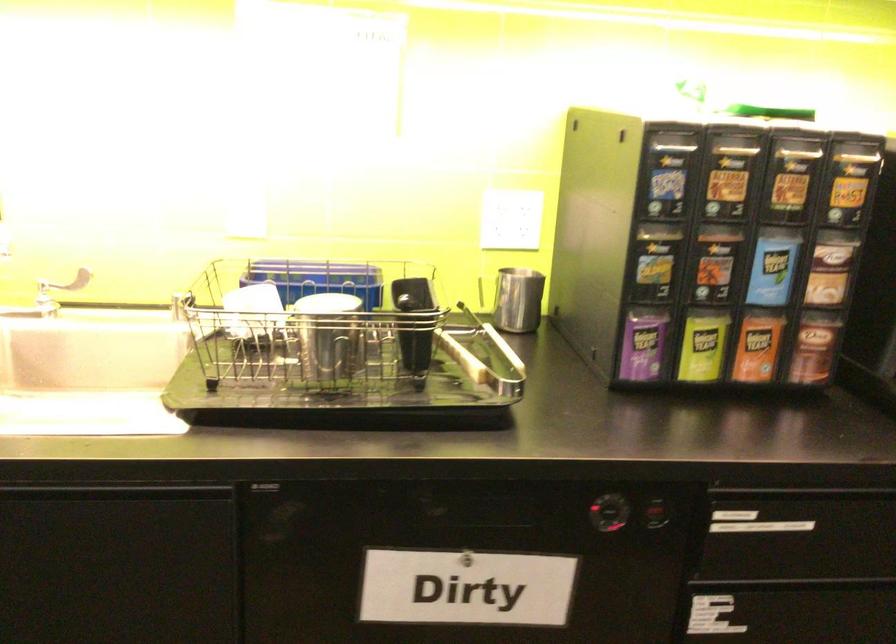
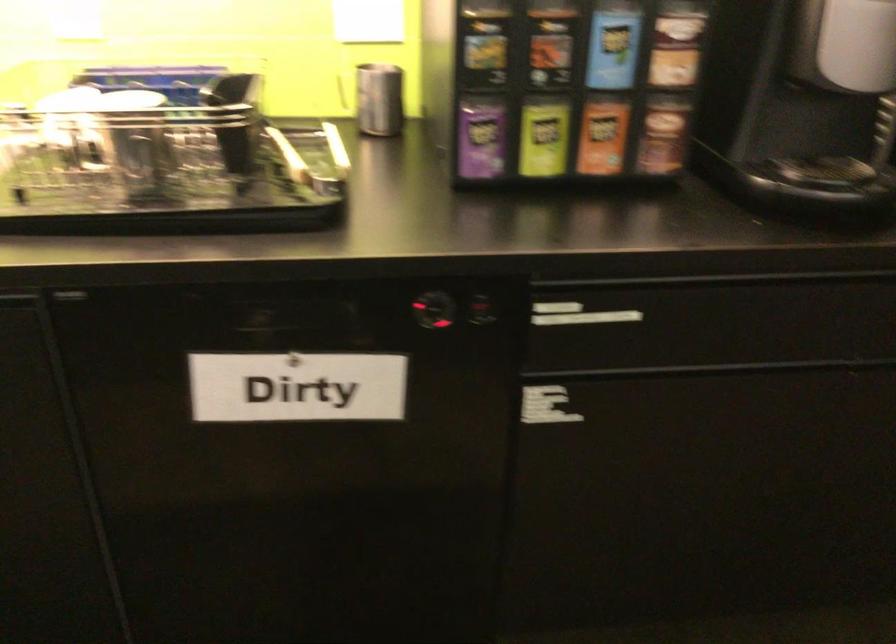
Find the pixel in the second image that matches the point at 607,515 in the first image.

(433, 310)